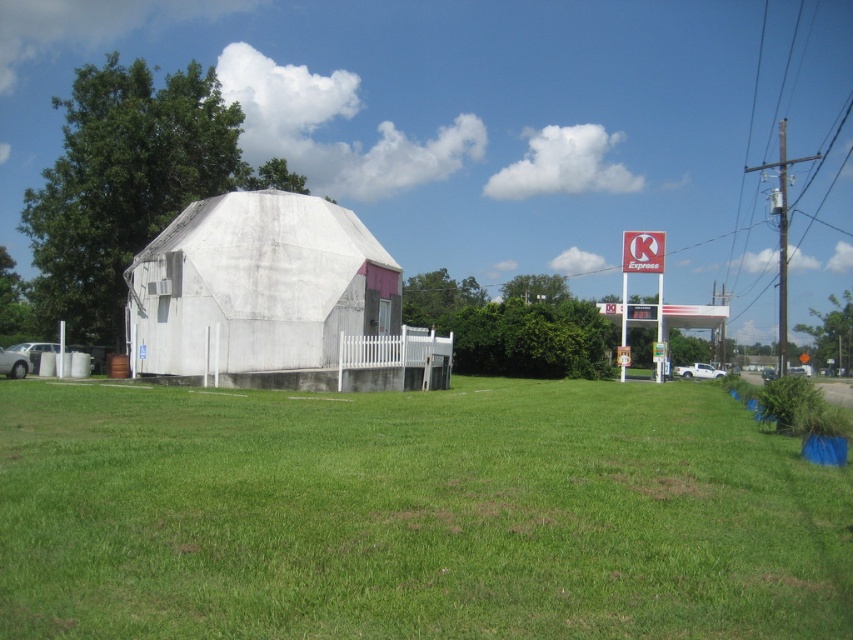
You are standing in the rural area and see the green grass at center and the white matte dome at center. Which one is located to the right side of the other?

The green grass at center is to the right of the white matte dome at center.

You are a gardener planning to mow the lawn in the rural scene. You have a lawnmower that can only handle areas smaller than the white matte dome at center. Will the green grass at center fit within the lawnmower capacity?

The green grass at center occupies less space than the white matte dome at center, so yes, the green grass at center will fit within the lawnmower capacity since it is smaller in area.

You are standing at the edge of the green grass at center and want to look up to see the white matte dome at center. In which direction should you look?

You should look upward because the green grass at center is below the white matte dome at center.